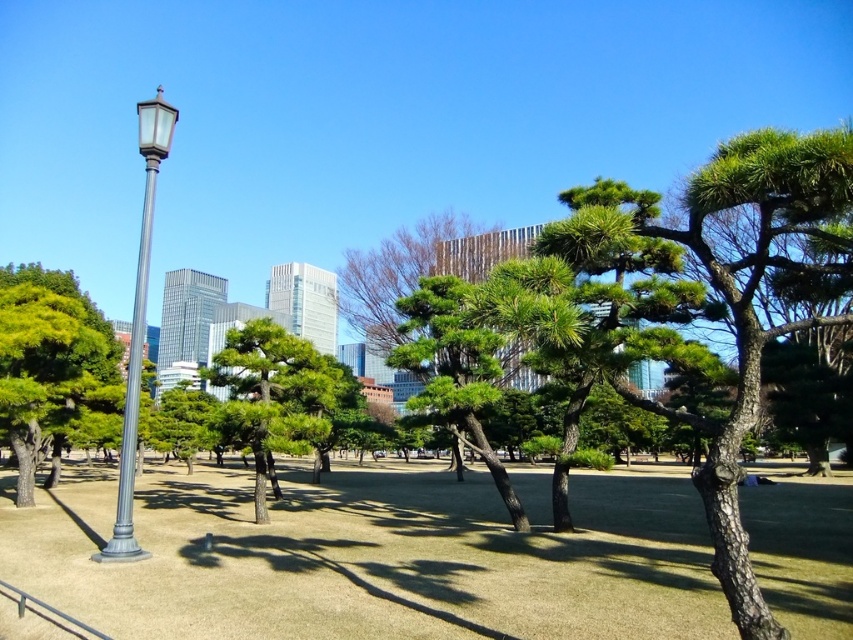
Question: Can you confirm if green textured tree at center is wider than polished metal street light at left?

Choices:
 (A) no
 (B) yes

Answer: (A)

Question: Which object is closer to the camera taking this photo?

Choices:
 (A) polished metal street light at left
 (B) green textured tree at left

Answer: (A)

Question: Can you confirm if green textured tree at left is positioned below green textured tree at center?

Choices:
 (A) no
 (B) yes

Answer: (A)

Question: Which of the following is the farthest from the observer?

Choices:
 (A) green textured tree at left
 (B) green textured tree at center
 (C) polished metal street light at left

Answer: (A)

Question: Where is green textured tree at left located in relation to polished metal street light at left in the image?

Choices:
 (A) above
 (B) below

Answer: (B)

Question: Among these points, which one is farthest from the camera?

Choices:
 (A) (126, 545)
 (B) (79, 326)
 (C) (294, 451)

Answer: (B)